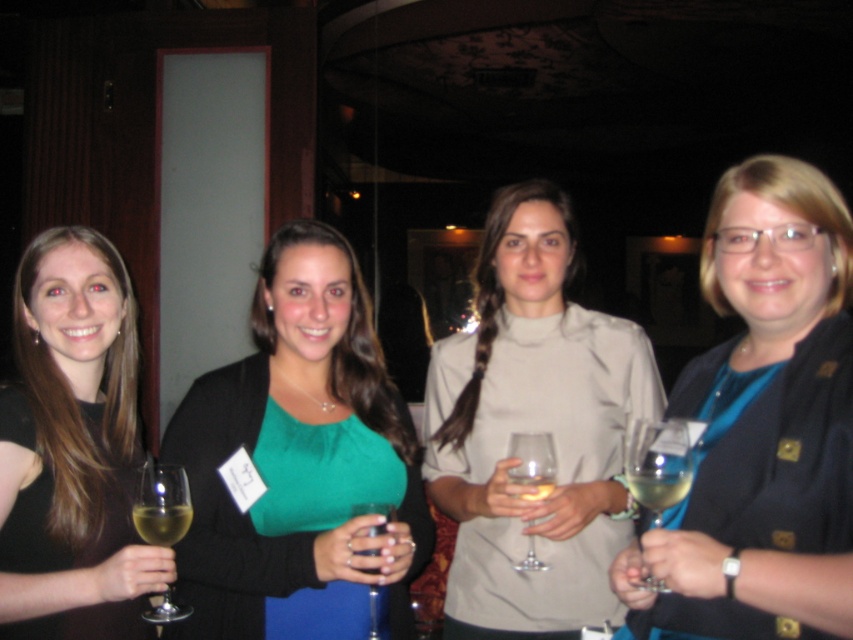
Question: Which point appears farthest from the camera in this image?

Choices:
 (A) (633, 497)
 (B) (453, 576)
 (C) (630, 484)

Answer: (B)

Question: Is matte black dress at left to the right of translucent glass wine glass at lower left from the viewer's perspective?

Choices:
 (A) no
 (B) yes

Answer: (A)

Question: Which is farther from the blue fabric shirt at center?

Choices:
 (A) transparent glass wine glass at center
 (B) matte beige blouse at center

Answer: (B)

Question: Does matte black dress at left appear on the left side of translucent glass wine glass at lower left?

Choices:
 (A) no
 (B) yes

Answer: (B)

Question: Can you confirm if clear glass wine glass at right is bigger than transparent glass wine glass at center?

Choices:
 (A) yes
 (B) no

Answer: (B)

Question: Which point is farther to the camera?

Choices:
 (A) matte beige blouse at center
 (B) blue fabric shirt at center
 (C) translucent glass wine glass at lower left
 (D) green fabric dress at center

Answer: (A)